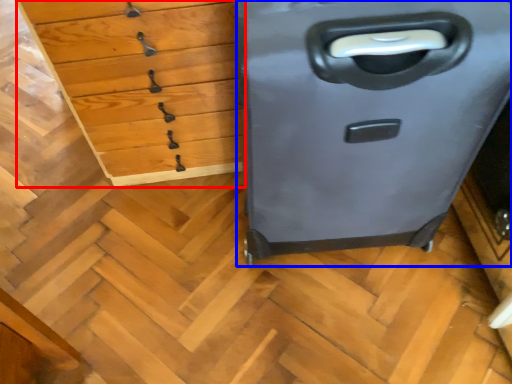
Question: Which of the following is the closest to the observer, chest of drawers (highlighted by a red box) or file cabinet (highlighted by a blue box)?

Choices:
 (A) chest of drawers
 (B) file cabinet

Answer: (B)